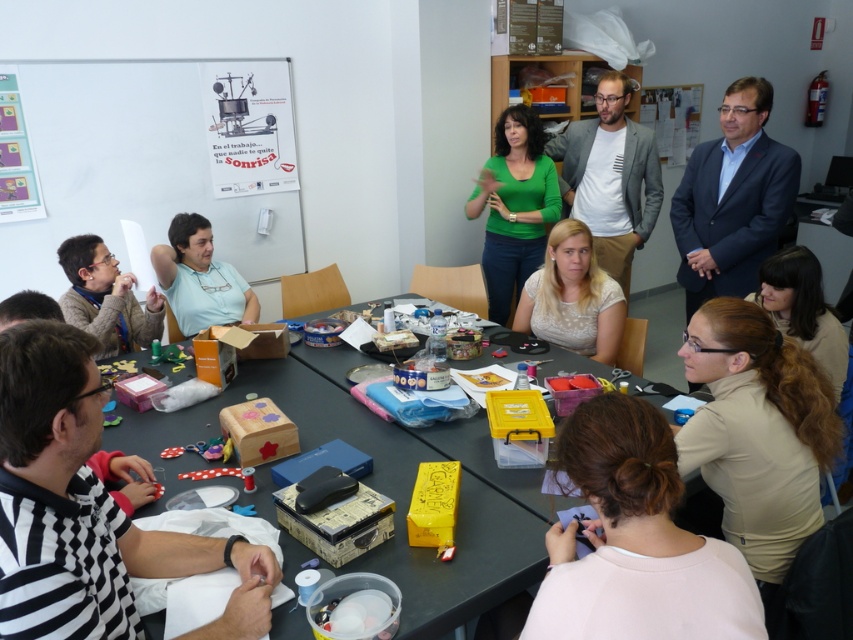
You are a person who needs to pass a 7.5 feet long tool from the matte light blue shirt at lower left to the brown hair at lower right. Can you do it without moving either of them?

The distance between the matte light blue shirt at lower left and the brown hair at lower right is 7.86 feet, so yes, the tool can be passed as it is slightly longer than the required distance.

You are an observer standing at the back of the room looking towards the table. Which of the two shirts, the black checkered shirt at lower left or the green matte shirt at center, is positioned lower on the table?

The black checkered shirt at lower left is positioned lower on the table than the green matte shirt at center.

You are standing at the center of the room. Which direction should you move to reach the black checkered shirt at lower left?

You should move towards the lower left direction to reach the black checkered shirt at lower left as it is located at point (x=86, y=509).